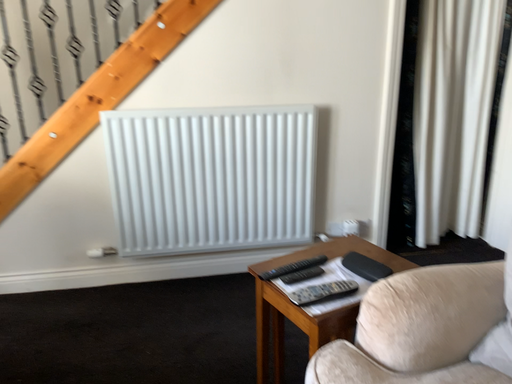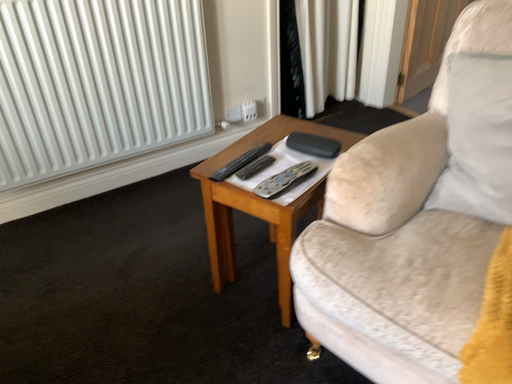
Question: Which way did the camera rotate in the video?

Choices:
 (A) rotated right
 (B) rotated left

Answer: (A)